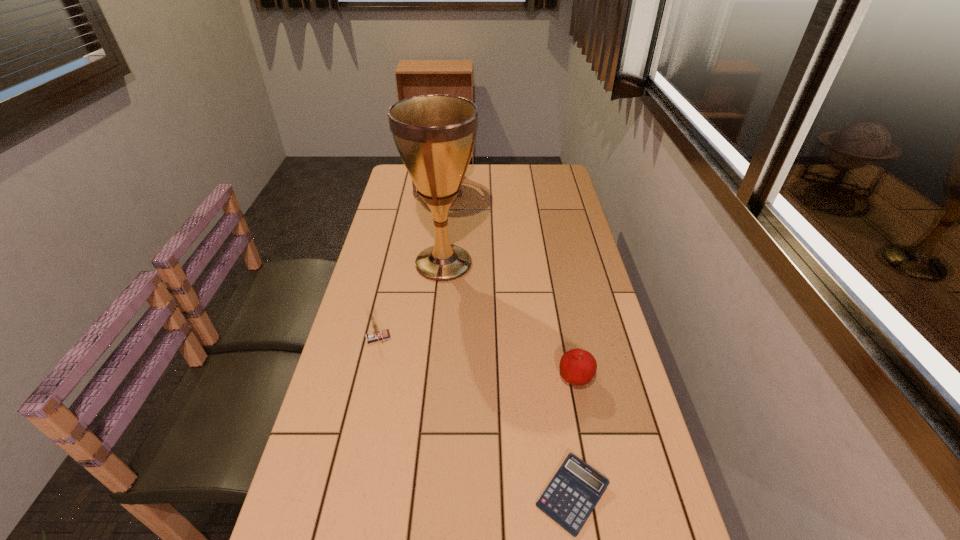
At what (x,y) coordinates should I click in order to perform the action: click on free space between the third tallest object and the shortest object. Please return your answer as a coordinate pair (x, y). Looking at the image, I should click on (475, 416).

Identify the location of free area in between the calculator and the globe. Image resolution: width=960 pixels, height=540 pixels. (506, 340).

Identify the location of free space between the globe and the second nearest object. (507, 282).

At what (x,y) coordinates should I click in order to perform the action: click on object that stands as the third closest to the nearest object. Please return your answer as a coordinate pair (x, y). Image resolution: width=960 pixels, height=540 pixels. Looking at the image, I should click on (435, 135).

The image size is (960, 540). I want to click on object that stands as the closest to the globe, so click(435, 135).

The width and height of the screenshot is (960, 540). I want to click on vacant region that satisfies the following two spatial constraints: 1. on the front side of the third farthest object; 2. on the right side of the second nearest object, so click(369, 380).

I want to click on vacant space that satisfies the following two spatial constraints: 1. on the front-facing side of the globe; 2. on the left side of the tallest object, so coord(428,264).

Where is `vacant position in the image that satisfies the following two spatial constraints: 1. on the front-facing side of the trophy cup; 2. on the right side of the second tallest object`? Image resolution: width=960 pixels, height=540 pixels. vacant position in the image that satisfies the following two spatial constraints: 1. on the front-facing side of the trophy cup; 2. on the right side of the second tallest object is located at coordinates (428, 264).

At what (x,y) coordinates should I click in order to perform the action: click on blank area in the image that satisfies the following two spatial constraints: 1. on the front-facing side of the globe; 2. on the right side of the nearest object. Please return your answer as a coordinate pair (x, y). Looking at the image, I should click on (396, 495).

Locate an element on the screen. Image resolution: width=960 pixels, height=540 pixels. free point that satisfies the following two spatial constraints: 1. on the front-facing side of the globe; 2. on the right side of the nearest object is located at coordinates (396, 495).